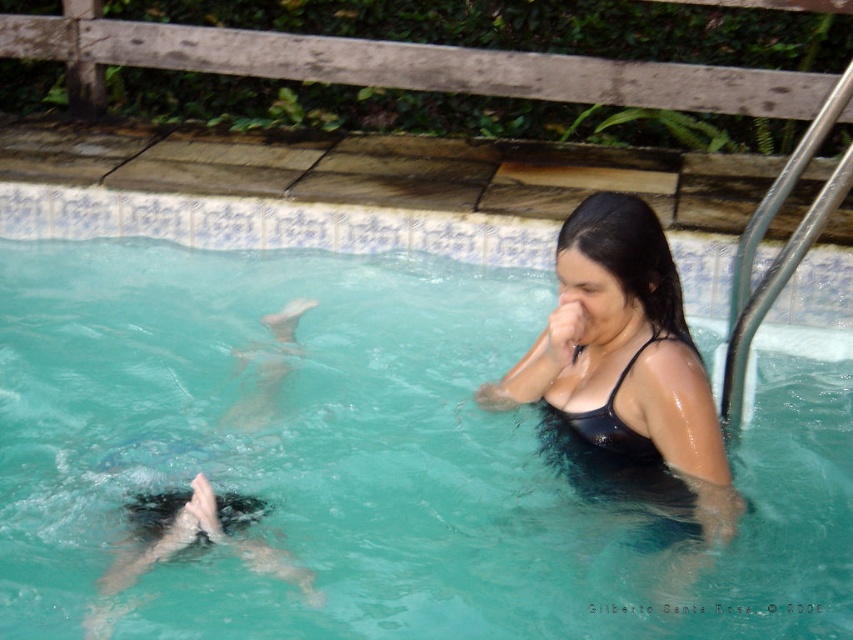
The width and height of the screenshot is (853, 640). What do you see at coordinates (625, 365) in the screenshot?
I see `black matte swimsuit at upper right` at bounding box center [625, 365].

Who is lower down, black matte swimsuit at upper right or black matte bikini top at upper right?

black matte bikini top at upper right

Does point (555, 360) lie behind point (699, 355)?

Yes, it is.

In order to click on black matte swimsuit at upper right in this screenshot , I will do `click(625, 365)`.

Is point (117, 403) closer to viewer compared to point (743, 502)?

No, it is not.

Who is more forward, (167, 412) or (602, 416)?

Positioned in front is point (602, 416).

At what (x,y) coordinates should I click in order to perform the action: click on clear plastic water at center. Please return your answer as a coordinate pair (x, y). This screenshot has height=640, width=853. Looking at the image, I should click on (367, 458).

The image size is (853, 640). Identify the location of clear plastic water at center. (367, 458).

Is clear plastic water at center in front of black matte bikini top at upper right?

No, clear plastic water at center is further to the viewer.

Is point (21, 560) closer to viewer compared to point (654, 460)?

No.

Identify the location of clear plastic water at center. (367, 458).